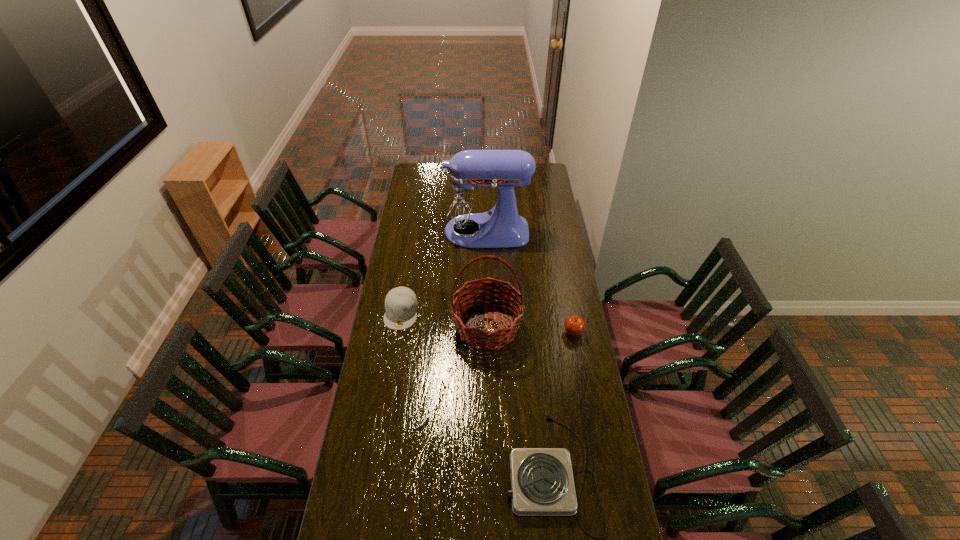
Locate an element on the screen. The image size is (960, 540). the farthest object is located at coordinates (465, 200).

This screenshot has width=960, height=540. I want to click on basket, so click(x=479, y=339).

Locate an element on the screen. The height and width of the screenshot is (540, 960). cap is located at coordinates (401, 304).

In order to click on apple in this screenshot , I will do `click(574, 325)`.

Identify the location of the nearest object. (542, 484).

At what (x,y) coordinates should I click in order to perform the action: click on hotplate. Please return your answer as a coordinate pair (x, y). Looking at the image, I should click on (542, 484).

The image size is (960, 540). I want to click on vacant space positioned 0.190m at the mixing area of the farthest object, so click(404, 232).

You are a GUI agent. You are given a task and a screenshot of the screen. Output one action in this format:
    pyautogui.click(x=<x>, y=<y>)
    Task: Click on the vacant space located 0.110m at the mixing area of the farthest object
    Image resolution: width=960 pixels, height=540 pixels.
    Given the screenshot: What is the action you would take?
    pyautogui.click(x=419, y=232)

Where is `vacant area located 0.110m at the mixing area of the farthest object`? This screenshot has height=540, width=960. vacant area located 0.110m at the mixing area of the farthest object is located at coordinates (419, 232).

Locate an element on the screen. The image size is (960, 540). vacant space located 0.220m on the handle side of the basket is located at coordinates (489, 404).